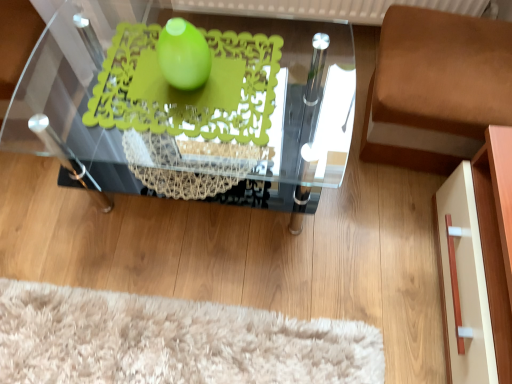
Where is `vacant space in green matte doily at center (from a real-world perspective)`? vacant space in green matte doily at center (from a real-world perspective) is located at coordinates [170, 105].